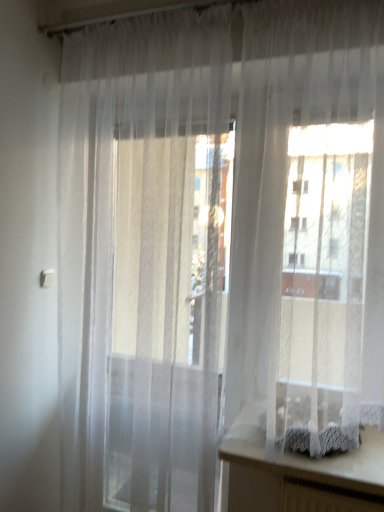
Question: Visually, is white lace vanity at lower right positioned to the left or to the right of sheer white curtain at center?

Choices:
 (A) left
 (B) right

Answer: (B)

Question: Considering their positions, is white lace vanity at lower right located in front of or behind sheer white curtain at center?

Choices:
 (A) behind
 (B) front

Answer: (A)

Question: Is point (311, 486) closer or farther from the camera than point (377, 73)?

Choices:
 (A) farther
 (B) closer

Answer: (A)

Question: From the image's perspective, is sheer white curtain at center above or below white lace vanity at lower right?

Choices:
 (A) below
 (B) above

Answer: (B)

Question: Considering the positions of sheer white curtain at center and white lace vanity at lower right in the image, is sheer white curtain at center wider or thinner than white lace vanity at lower right?

Choices:
 (A) wide
 (B) thin

Answer: (B)

Question: Considering their positions, is sheer white curtain at center located in front of or behind white lace vanity at lower right?

Choices:
 (A) front
 (B) behind

Answer: (A)

Question: Considering the positions of sheer white curtain at center and white lace vanity at lower right in the image, is sheer white curtain at center taller or shorter than white lace vanity at lower right?

Choices:
 (A) tall
 (B) short

Answer: (A)